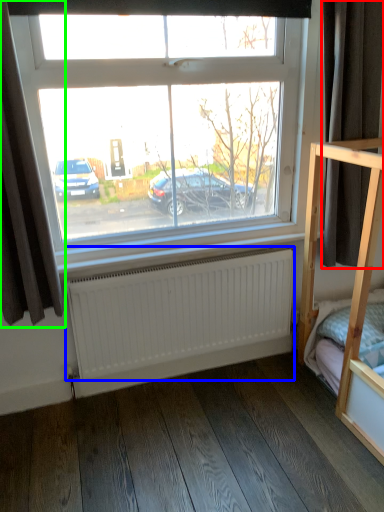
Question: Considering the real-world distances, which object is farthest from curtain (highlighted by a red box)? radiator (highlighted by a blue box) or curtain (highlighted by a green box)?

Choices:
 (A) radiator
 (B) curtain

Answer: (B)